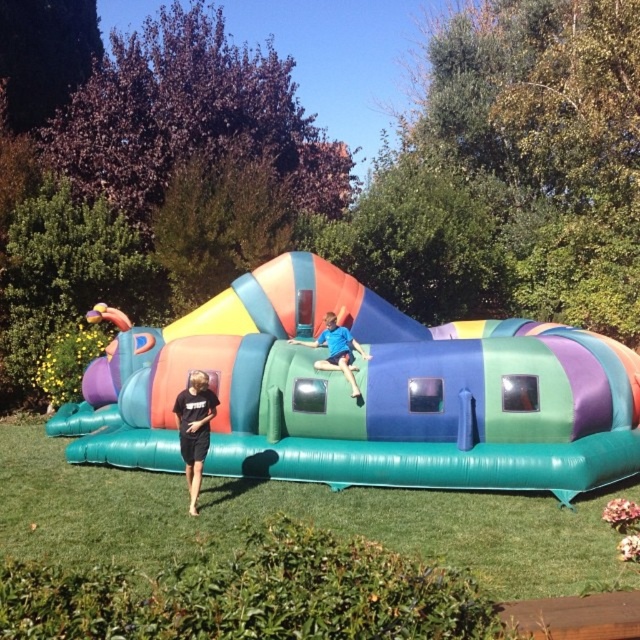
From the picture: Does multicolored inflatable at center have a lesser height compared to black matte t-shirt at lower left?

Indeed, multicolored inflatable at center has a lesser height compared to black matte t-shirt at lower left.

Can you confirm if multicolored inflatable at center is bigger than black matte t-shirt at lower left?

Actually, multicolored inflatable at center might be smaller than black matte t-shirt at lower left.

Which is in front, point (504, 348) or point (205, 428)?

Point (205, 428)

Where is `multicolored inflatable at center`? This screenshot has height=640, width=640. multicolored inflatable at center is located at coordinates (364, 394).

Which is above, multicolored inflatable at center or blue matte shirt at center?

multicolored inflatable at center

Is point (509, 394) in front of point (346, 378)?

Yes, point (509, 394) is in front of point (346, 378).

Where is `multicolored inflatable at center`? multicolored inflatable at center is located at coordinates (364, 394).

Is point (209, 428) positioned after point (333, 332)?

That is False.

Does point (188, 435) come farther from viewer compared to point (332, 326)?

No, it is in front of (332, 326).

This screenshot has height=640, width=640. Identify the location of black matte t-shirt at lower left. (195, 429).